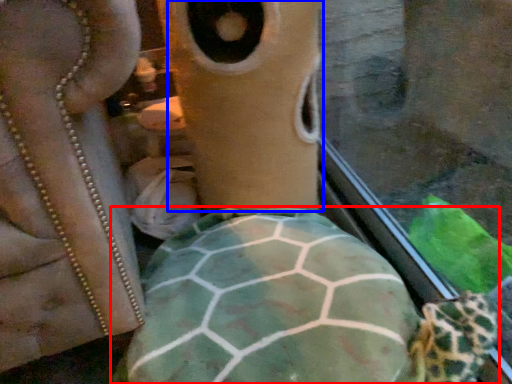
Question: Which of the following is the closest to the observer, tortoise (highlighted by a red box) or face (highlighted by a blue box)?

Choices:
 (A) tortoise
 (B) face

Answer: (A)